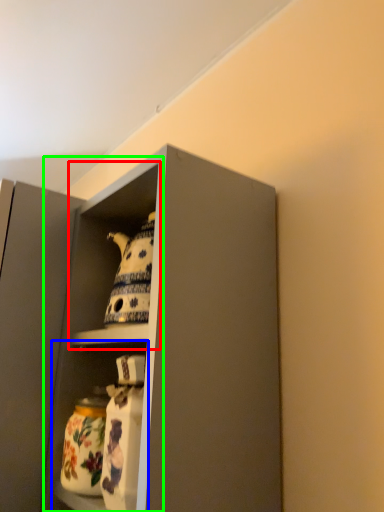
Question: Estimate the real-world distances between objects in this image. Which object is closer to cabinet (highlighted by a red box), shelf (highlighted by a blue box) or cabinet (highlighted by a green box)?

Choices:
 (A) shelf
 (B) cabinet

Answer: (B)